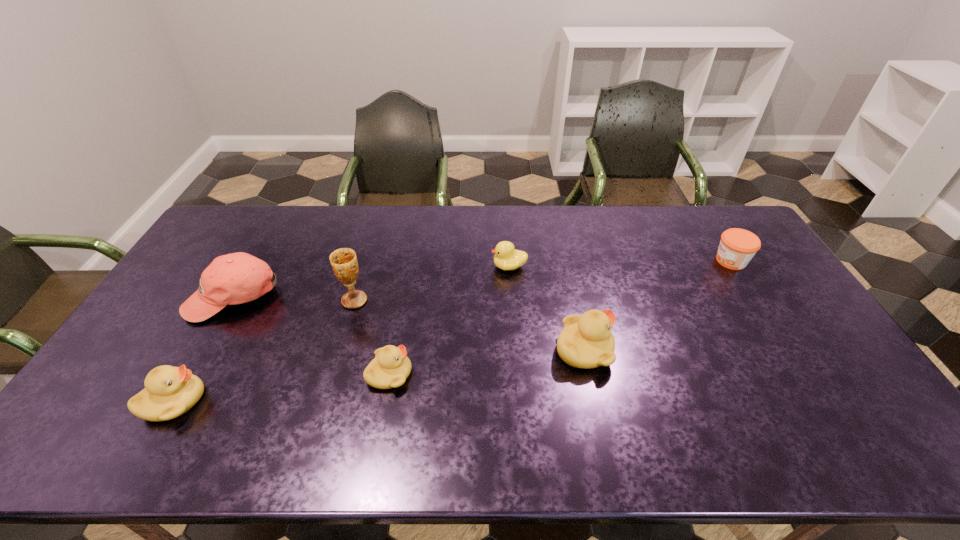
Identify the location of vacant point located 0.150m on the front of the baseball cap. The image size is (960, 540). (194, 367).

This screenshot has width=960, height=540. Identify the location of duckling present at the left edge. (169, 392).

Locate an element on the screen. Image resolution: width=960 pixels, height=540 pixels. baseball cap situated at the left edge is located at coordinates (236, 278).

Locate an element on the screen. object located in the right edge section of the desktop is located at coordinates (737, 247).

Where is `object that is at the near left corner`? The image size is (960, 540). object that is at the near left corner is located at coordinates (169, 392).

Locate an element on the screen. vacant space at the far edge of the desktop is located at coordinates (360, 205).

Where is `vacant space at the near edge`? The image size is (960, 540). vacant space at the near edge is located at coordinates (564, 387).

In the image, there is a desktop. Identify the location of vacant space at the left edge. This screenshot has width=960, height=540. (242, 247).

This screenshot has height=540, width=960. In the image, there is a desktop. Identify the location of free region at the right edge. (774, 299).

The height and width of the screenshot is (540, 960). In the image, there is a desktop. Find the location of `vacant space at the far left corner`. vacant space at the far left corner is located at coordinates (238, 220).